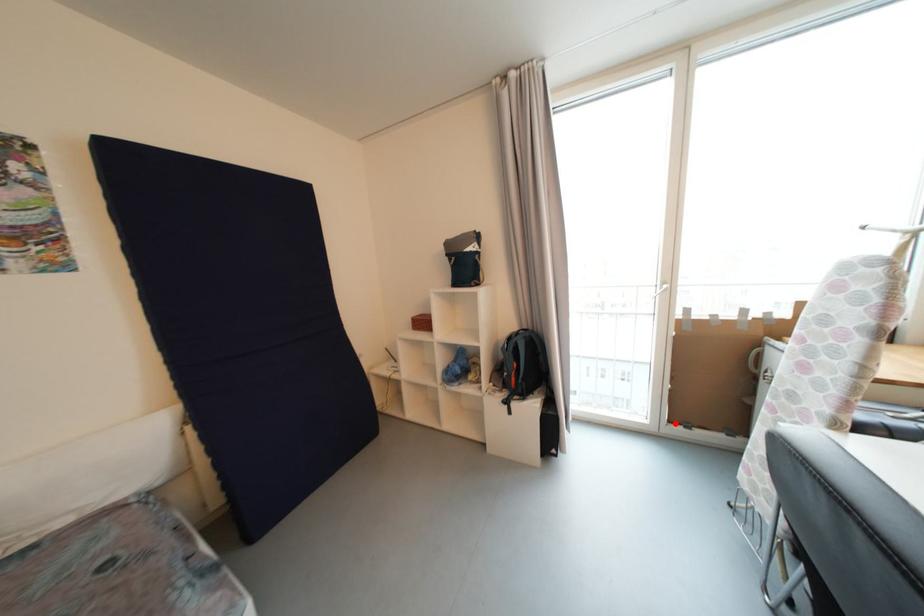
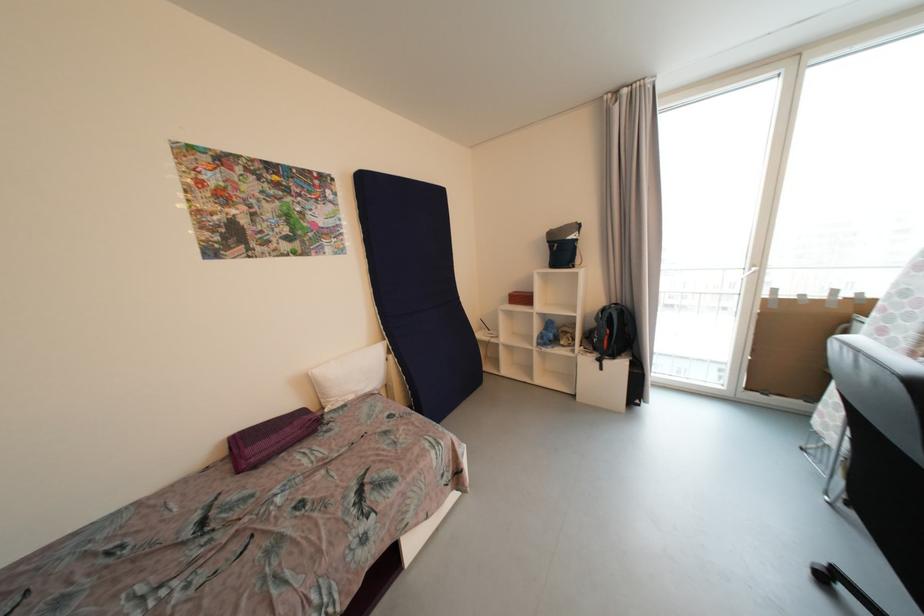
The point at the highlighted location is marked in the first image. Where is the corresponding point in the second image?

(752, 390)